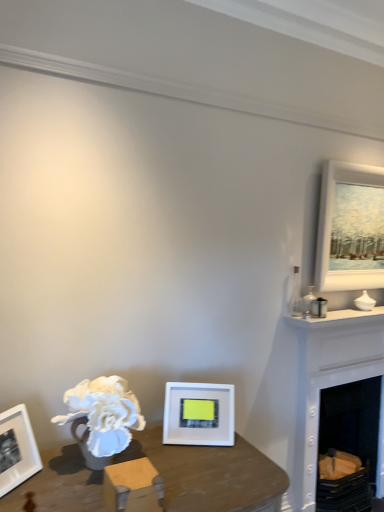
Question: Is white painted wood fireplace at right positioned in front of white matte picture frame at lower center, the 2th picture frame in the right-to-left sequence?

Choices:
 (A) yes
 (B) no

Answer: (B)

Question: From the image's perspective, is white painted wood fireplace at right on white matte picture frame at lower center, placed as the first picture frame when sorted from front to back?

Choices:
 (A) yes
 (B) no

Answer: (B)

Question: Is white painted wood fireplace at right looking in the opposite direction of white matte picture frame at lower center, placed as the 1th picture frame when sorted from left to right?

Choices:
 (A) no
 (B) yes

Answer: (A)

Question: Considering the relative sizes of white painted wood fireplace at right and white matte picture frame at lower center, the 2th picture frame viewed from the back, in the image provided, is white painted wood fireplace at right wider than white matte picture frame at lower center, the 2th picture frame viewed from the back,?

Choices:
 (A) no
 (B) yes

Answer: (B)

Question: Considering the relative sizes of white painted wood fireplace at right and white matte picture frame at lower center, marked as the second picture frame in a top-to-bottom arrangement, in the image provided, is white painted wood fireplace at right shorter than white matte picture frame at lower center, marked as the second picture frame in a top-to-bottom arrangement,?

Choices:
 (A) no
 (B) yes

Answer: (A)

Question: Does white painted wood fireplace at right lie behind white matte picture frame at lower center, the 1th picture frame ordered from the bottom?

Choices:
 (A) no
 (B) yes

Answer: (B)

Question: Does white matte picture frame at upper right, acting as the first picture frame starting from the back, come behind white painted wood fireplace at right?

Choices:
 (A) yes
 (B) no

Answer: (A)

Question: Is white matte picture frame at upper right, the 2th picture frame when ordered from bottom to top, oriented away from white painted wood fireplace at right?

Choices:
 (A) no
 (B) yes

Answer: (A)

Question: Is white matte picture frame at upper right, the second picture frame from the front, to the left of white painted wood fireplace at right from the viewer's perspective?

Choices:
 (A) no
 (B) yes

Answer: (A)

Question: Considering the relative sizes of white matte picture frame at upper right, which is the second picture frame from left to right, and white painted wood fireplace at right in the image provided, is white matte picture frame at upper right, which is the second picture frame from left to right, smaller than white painted wood fireplace at right?

Choices:
 (A) yes
 (B) no

Answer: (A)

Question: From the image's perspective, is white matte picture frame at upper right, which ranks as the 1th picture frame in top-to-bottom order, over white painted wood fireplace at right?

Choices:
 (A) yes
 (B) no

Answer: (A)

Question: From a real-world perspective, is white matte picture frame at upper right, which is the second picture frame from left to right, beneath white painted wood fireplace at right?

Choices:
 (A) no
 (B) yes

Answer: (A)

Question: Considering the relative sizes of white matte picture frame at lower center, placed as the first picture frame when sorted from front to back, and white matte picture frame at upper right, acting as the first picture frame starting from the back, in the image provided, is white matte picture frame at lower center, placed as the first picture frame when sorted from front to back, taller than white matte picture frame at upper right, acting as the first picture frame starting from the back,?

Choices:
 (A) yes
 (B) no

Answer: (B)